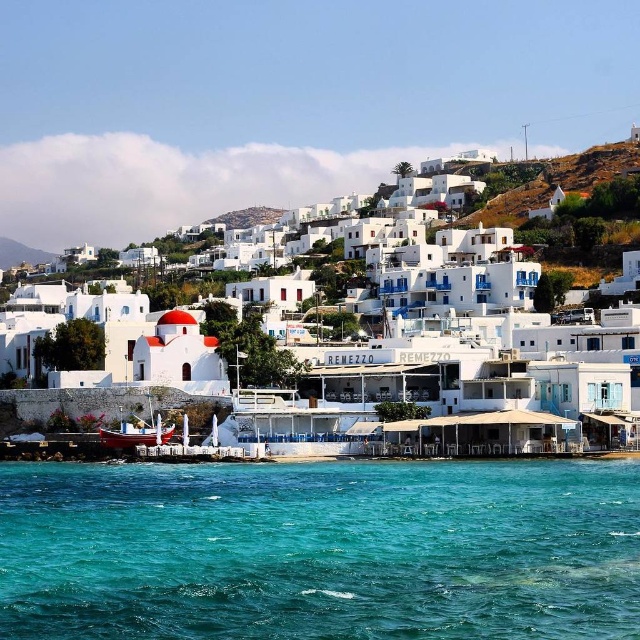
Who is lower down, turquoise liquid at lower center or wooden boat at lower left?

turquoise liquid at lower center is below.

Can you confirm if turquoise liquid at lower center is thinner than wooden boat at lower left?

In fact, turquoise liquid at lower center might be wider than wooden boat at lower left.

Who is more forward, (545, 468) or (104, 429)?

Positioned in front is point (545, 468).

The image size is (640, 640). What are the coordinates of `turquoise liquid at lower center` in the screenshot? It's located at (321, 548).

From the picture: Can you confirm if white matte building at center is positioned to the left of wooden boat at lower left?

In fact, white matte building at center is to the right of wooden boat at lower left.

This screenshot has height=640, width=640. Identify the location of white matte building at center. (456, 364).

Is turquoise liquid at lower center in front of white matte building at center?

Yes, turquoise liquid at lower center is closer to the viewer.

Does point (212, 509) lie behind point (396, 387)?

That is False.

Identify the location of turquoise liquid at lower center. The image size is (640, 640). (321, 548).

Where is `turquoise liquid at lower center`? The height and width of the screenshot is (640, 640). turquoise liquid at lower center is located at coordinates point(321,548).